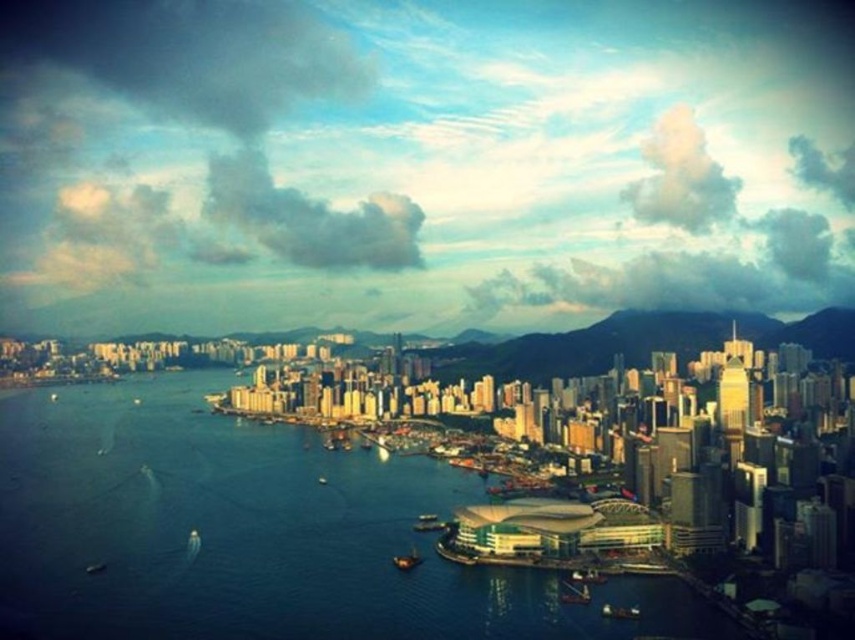
Question: Is blue water at center wider than metallic gray boat at lower center?

Choices:
 (A) yes
 (B) no

Answer: (A)

Question: Among these objects, which one is nearest to the camera?

Choices:
 (A) blue water at center
 (B) metallic gray boat at lower center

Answer: (A)

Question: Is blue water at center to the left of metallic gray boat at lower center from the viewer's perspective?

Choices:
 (A) no
 (B) yes

Answer: (B)

Question: Which point appears closest to the camera in this image?

Choices:
 (A) (411, 560)
 (B) (34, 518)

Answer: (A)

Question: Is blue water at center bigger than metallic gray boat at lower center?

Choices:
 (A) no
 (B) yes

Answer: (B)

Question: Among these objects, which one is nearest to the camera?

Choices:
 (A) metallic gray boat at lower center
 (B) blue water at center

Answer: (B)